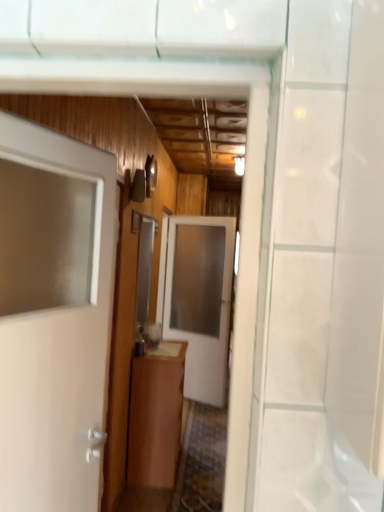
Question: In which direction should I rotate to look at white glossy door at center, arranged as the first door when viewed from the back?

Choices:
 (A) right
 (B) left

Answer: (B)

Question: Can you confirm if brown wood cabinet at center is bigger than white glossy door at center, the 2th door positioned from the front?

Choices:
 (A) no
 (B) yes

Answer: (B)

Question: Is brown wood cabinet at center outside of white glossy door at center, the 2th door positioned from the front?

Choices:
 (A) yes
 (B) no

Answer: (A)

Question: Is brown wood cabinet at center facing towards white glossy door at center, the 2th door positioned from the front?

Choices:
 (A) no
 (B) yes

Answer: (A)

Question: Can white glossy door at center, the 2th door positioned from the front, be found inside brown wood cabinet at center?

Choices:
 (A) yes
 (B) no

Answer: (B)

Question: Is brown wood cabinet at center taller than white glossy door at center, the 2th door positioned from the front?

Choices:
 (A) yes
 (B) no

Answer: (B)

Question: From the image's perspective, is brown wood cabinet at center beneath white glossy door at center, arranged as the first door when viewed from the back?

Choices:
 (A) yes
 (B) no

Answer: (A)

Question: From a real-world perspective, is white glossy door at center, arranged as the first door when viewed from the back, positioned over white glossy door at left, marked as the second door in a back-to-front arrangement, based on gravity?

Choices:
 (A) no
 (B) yes

Answer: (A)

Question: From the image's perspective, is white glossy door at center, arranged as the first door when viewed from the back, located above white glossy door at left, marked as the second door in a back-to-front arrangement?

Choices:
 (A) no
 (B) yes

Answer: (A)

Question: Is white glossy door at center, the 2th door positioned from the front, positioned with its back to white glossy door at left, which is the 1th door in front-to-back order?

Choices:
 (A) no
 (B) yes

Answer: (A)

Question: Does white glossy door at center, the 2th door positioned from the front, appear on the right side of white glossy door at left, marked as the second door in a back-to-front arrangement?

Choices:
 (A) yes
 (B) no

Answer: (A)

Question: Could you tell me if white glossy door at center, the 2th door positioned from the front, is turned towards white glossy door at left, marked as the second door in a back-to-front arrangement?

Choices:
 (A) no
 (B) yes

Answer: (A)

Question: Does white glossy door at center, the 2th door positioned from the front, have a greater width compared to white glossy door at left, which is the 1th door in front-to-back order?

Choices:
 (A) yes
 (B) no

Answer: (B)

Question: Would you say white glossy door at left, which is the 1th door in front-to-back order, contains brown wood cabinet at center?

Choices:
 (A) no
 (B) yes

Answer: (A)